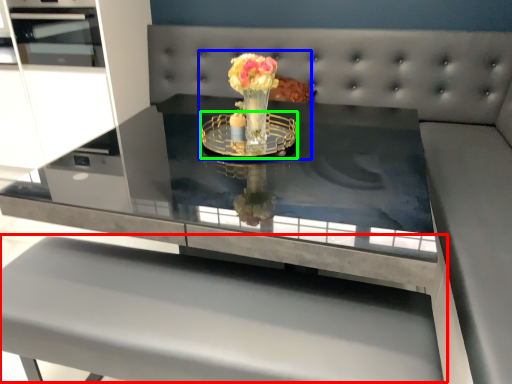
Question: Estimate the real-world distances between objects in this image. Which object is farther from table (highlighted by a red box), floral arrangement (highlighted by a blue box) or glass plate (highlighted by a green box)?

Choices:
 (A) floral arrangement
 (B) glass plate

Answer: (A)